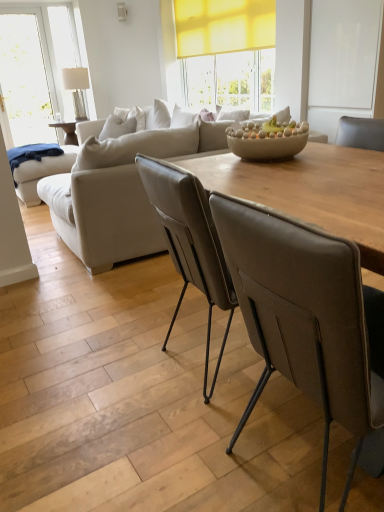
Question: Is brown leather chair at center not near beige leather couch at center?

Choices:
 (A) no
 (B) yes

Answer: (B)

Question: Considering the relative positions of brown leather chair at center and beige leather couch at center in the image provided, is brown leather chair at center behind beige leather couch at center?

Choices:
 (A) no
 (B) yes

Answer: (A)

Question: From a real-world perspective, is brown leather chair at center physically above beige leather couch at center?

Choices:
 (A) yes
 (B) no

Answer: (B)

Question: Considering the relative sizes of brown leather chair at center and beige leather couch at center in the image provided, is brown leather chair at center smaller than beige leather couch at center?

Choices:
 (A) yes
 (B) no

Answer: (A)

Question: Does brown leather chair at center turn towards beige leather couch at center?

Choices:
 (A) no
 (B) yes

Answer: (A)

Question: From a real-world perspective, does brown leather chair at center sit lower than beige leather couch at center?

Choices:
 (A) yes
 (B) no

Answer: (A)

Question: Does clear glass lamp at upper left have a greater width compared to wooden table at center?

Choices:
 (A) no
 (B) yes

Answer: (A)

Question: From the image's perspective, is clear glass lamp at upper left located above wooden table at center?

Choices:
 (A) yes
 (B) no

Answer: (A)

Question: From a real-world perspective, is clear glass lamp at upper left beneath wooden table at center?

Choices:
 (A) no
 (B) yes

Answer: (A)

Question: Is clear glass lamp at upper left to the right of wooden table at center from the viewer's perspective?

Choices:
 (A) yes
 (B) no

Answer: (B)

Question: Is clear glass lamp at upper left oriented away from wooden table at center?

Choices:
 (A) no
 (B) yes

Answer: (A)

Question: Are clear glass lamp at upper left and wooden table at center far apart?

Choices:
 (A) yes
 (B) no

Answer: (A)

Question: Is wooden table at center wider than brown leather chair at center?

Choices:
 (A) no
 (B) yes

Answer: (A)